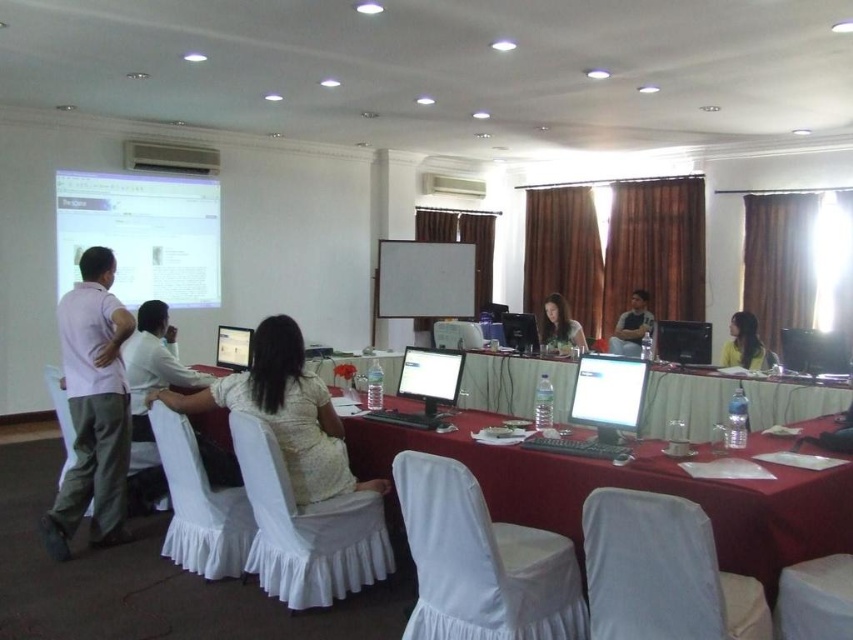
Between white matte board at center and light brown fabric dress at center, which one appears on the left side from the viewer's perspective?

white matte board at center

In the scene shown: Can you confirm if white matte board at center is positioned to the right of light brown fabric dress at center?

No, white matte board at center is not to the right of light brown fabric dress at center.

What do you see at coordinates (424, 280) in the screenshot? This screenshot has height=640, width=853. I see `white matte board at center` at bounding box center [424, 280].

Where is `white matte board at center`? The image size is (853, 640). white matte board at center is located at coordinates (424, 280).

Does point (292, 442) come behind point (467, 301)?

No, it is in front of (467, 301).

Where is `white textured dress at center`? white textured dress at center is located at coordinates (283, 412).

Can you confirm if white cotton shirt at left is smaller than white matte board at center?

Yes.

Find the location of `white cotton shirt at left`. white cotton shirt at left is located at coordinates (93, 406).

The width and height of the screenshot is (853, 640). Find the location of `white cotton shirt at left`. white cotton shirt at left is located at coordinates (93, 406).